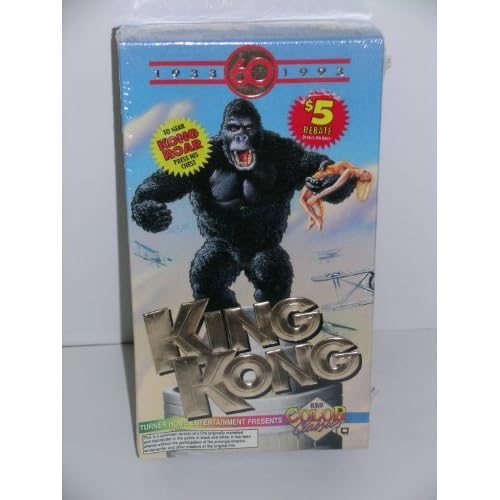
This screenshot has width=500, height=500. I want to click on table, so click(414, 379).